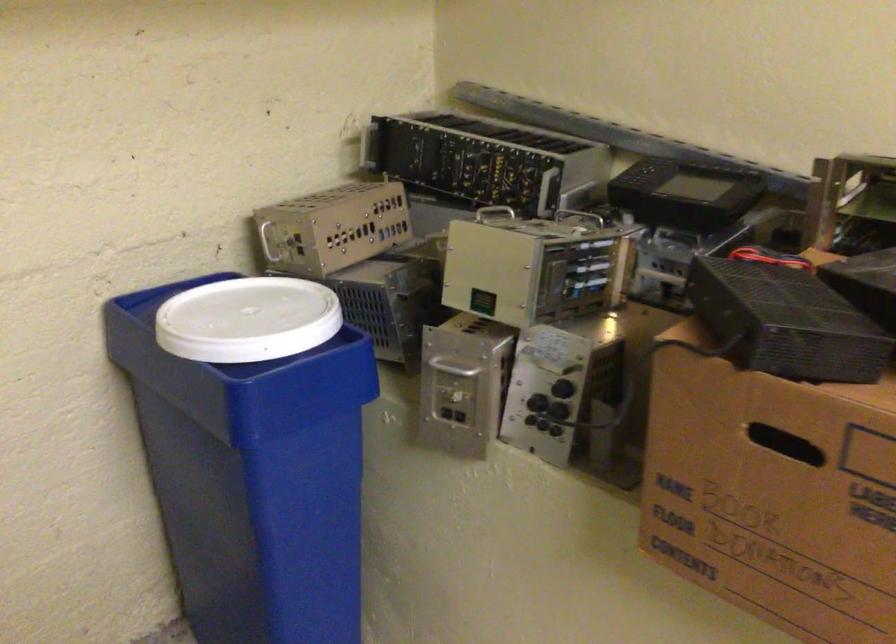
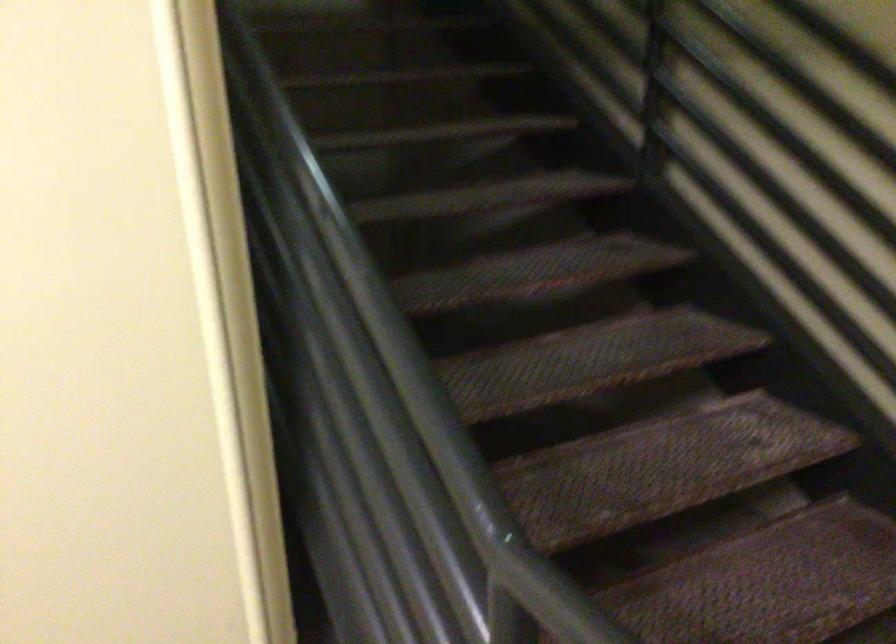
The first image is from the beginning of the video and the second image is from the end. How did the camera likely rotate when shooting the video?

The camera rotated toward left-down.